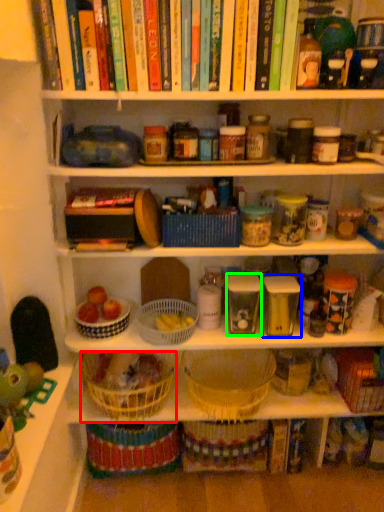
Question: Which object is the closest to the basket (highlighted by a red box)? Choose among these: glass jar (highlighted by a blue box) or glass jar (highlighted by a green box).

Choices:
 (A) glass jar
 (B) glass jar

Answer: (B)